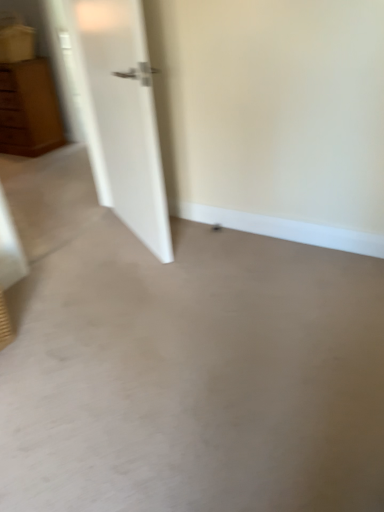
The image size is (384, 512). Identify the location of blank space above beige matte concrete at center (from a real-world perspective). (156, 361).